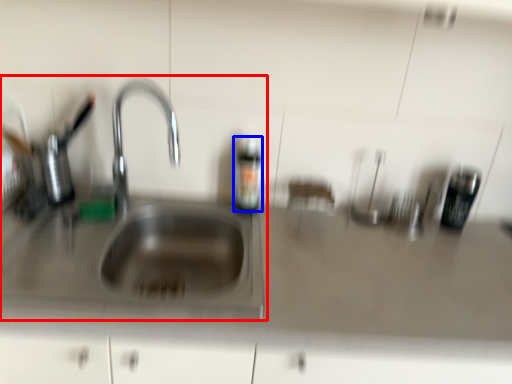
Question: Among these objects, which one is farthest to the camera, sink (highlighted by a red box) or bottle (highlighted by a blue box)?

Choices:
 (A) sink
 (B) bottle

Answer: (B)